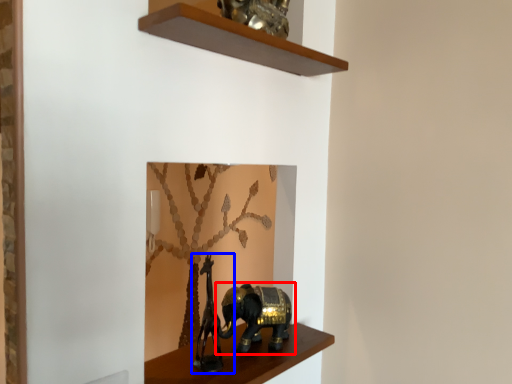
Question: Which point is further to the camera, elephant (highlighted by a red box) or animal sculpture (highlighted by a blue box)?

Choices:
 (A) elephant
 (B) animal sculpture

Answer: (A)